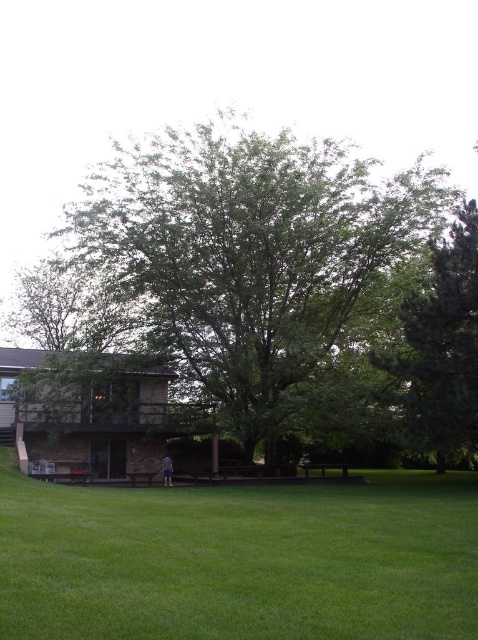
You are planning to install a small garden in the area shown in the image. Considering the space occupied by the green grass at center and the green leafy tree at right, which one takes up more space?

The green leafy tree at right takes up more space than the green grass at center, as the green grass at center has a smaller size compared to green leafy tree at right.

You are planning to install a garden bench in the area between the green leafy tree at center and the green leafy tree at right. Considering their widths, which tree would require more space to accommodate the bench?

The green leafy tree at center has a greater width than the green leafy tree at right, so it would require more space to accommodate the bench.

You are standing in the middle of the scene and want to place a small garden statue on the ground. Which object, the green leafy tree at center or the green grass at center, is the correct surface to place it on?

The green grass at center is the correct surface to place the statue because the green leafy tree at center is above it and cannot support objects on its branches.